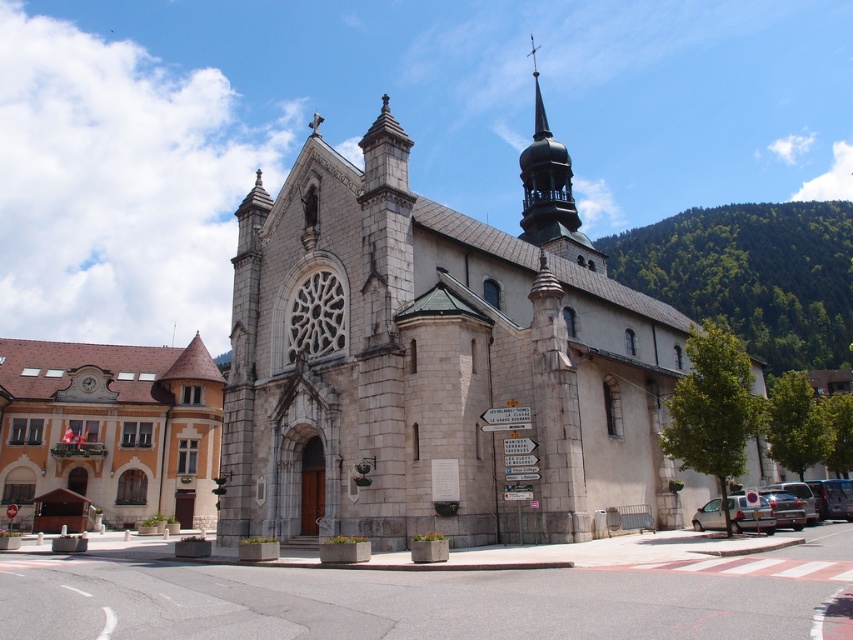
You are an architect visiting the town square and see the matte stone church at center and the gold textured spire at upper right. Which object is positioned higher in the image?

The gold textured spire at upper right is positioned higher than the matte stone church at center.

You are a tourist standing in the town square and want to take a photo that includes both the stone church at center and the gold textured spire at upper right. Which object should you position closer to the edge of your camera frame to ensure both are fully visible?

You should position the gold textured spire at upper right closer to the edge of your camera frame because the stone church at center might be wider than the gold textured spire at upper right, so centering the church would allow the spire to still fit within the frame.

You are a tourist standing in the town square looking at the stone church at center and the silver metallic car at lower right. Which object is positioned higher in the image?

The stone church at center is located above the silver metallic car at lower right, so it is positioned higher in the image.